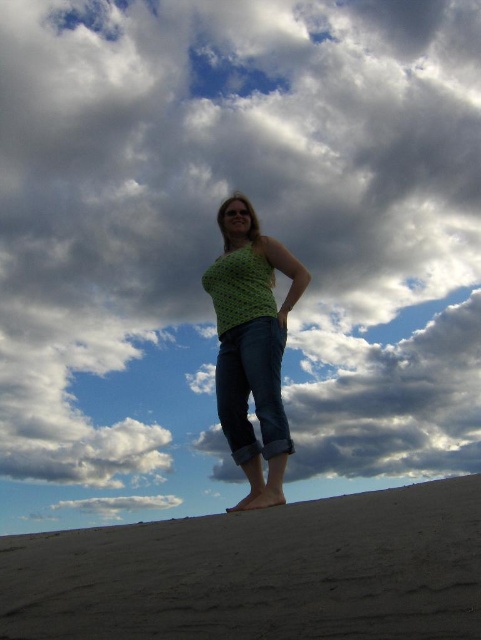
Question: Is green crochet tank top at center bigger than denim at center?

Choices:
 (A) yes
 (B) no

Answer: (A)

Question: Is green crochet tank top at center thinner than denim at center?

Choices:
 (A) no
 (B) yes

Answer: (A)

Question: Does green crochet tank top at center appear on the left side of denim at center?

Choices:
 (A) yes
 (B) no

Answer: (B)

Question: Which object appears closest to the camera in this image?

Choices:
 (A) green crochet tank top at center
 (B) dark brown sand at lower center

Answer: (B)

Question: Estimate the real-world distances between objects in this image. Which object is closer to the denim at center?

Choices:
 (A) dark brown sand at lower center
 (B) green crochet tank top at center

Answer: (B)

Question: Estimate the real-world distances between objects in this image. Which object is farther from the dark brown sand at lower center?

Choices:
 (A) denim at center
 (B) green crochet tank top at center

Answer: (B)